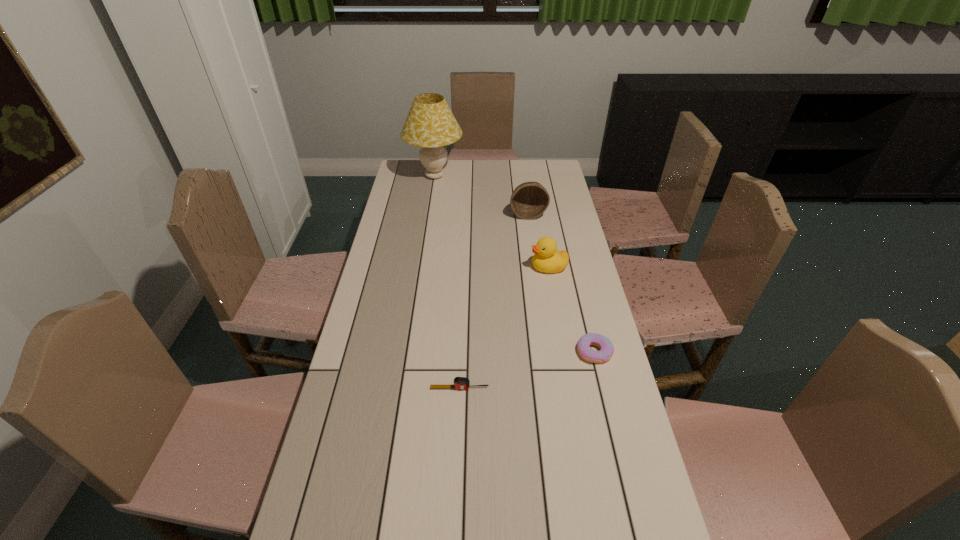
Where is `the farthest object`? the farthest object is located at coordinates (430, 124).

In order to click on the tallest object in this screenshot , I will do `click(430, 124)`.

This screenshot has width=960, height=540. What are the coordinates of `the fourth nearest object` in the screenshot? It's located at (529, 200).

The height and width of the screenshot is (540, 960). Find the location of `bowl`. bowl is located at coordinates (529, 200).

The height and width of the screenshot is (540, 960). Find the location of `the third shortest object`. the third shortest object is located at coordinates (547, 259).

Find the location of `duck`. duck is located at coordinates (547, 259).

Where is `the nearest object`? The height and width of the screenshot is (540, 960). the nearest object is located at coordinates point(460,383).

At what (x,y) coordinates should I click in order to perform the action: click on the fourth farthest object. Please return your answer as a coordinate pair (x, y). Looking at the image, I should click on (606, 347).

Where is `free space located 0.310m on the right of the farthest object`? free space located 0.310m on the right of the farthest object is located at coordinates (528, 176).

Where is `free space located 0.080m on the right of the fourth nearest object`? The image size is (960, 540). free space located 0.080m on the right of the fourth nearest object is located at coordinates (565, 214).